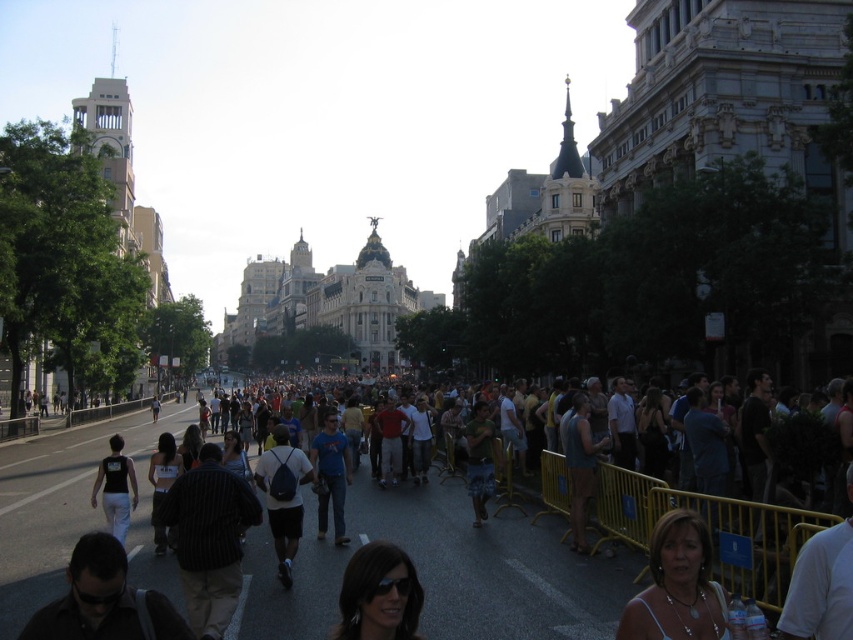
Question: Does yellow metallic barricade at right appear on the right side of dark striped shirt at center?

Choices:
 (A) yes
 (B) no

Answer: (A)

Question: From the image, what is the correct spatial relationship of matte blue tank top at center in relation to blue cotton shirt at center?

Choices:
 (A) right
 (B) left

Answer: (A)

Question: Is matte black sunglasses at lower center bigger than matte blue tank top at center?

Choices:
 (A) no
 (B) yes

Answer: (A)

Question: Estimate the real-world distances between objects in this image. Which object is farther from the matte blue tank top at center?

Choices:
 (A) green fabric shirt at center
 (B) dark brown leather jacket at lower left

Answer: (B)

Question: Which point appears farthest from the camera in this image?

Choices:
 (A) (158, 506)
 (B) (201, 612)
 (C) (339, 598)
 (D) (134, 477)

Answer: (A)

Question: Among these objects, which one is nearest to the camera?

Choices:
 (A) black fabric shirt at lower left
 (B) matte black sunglasses at lower center

Answer: (B)